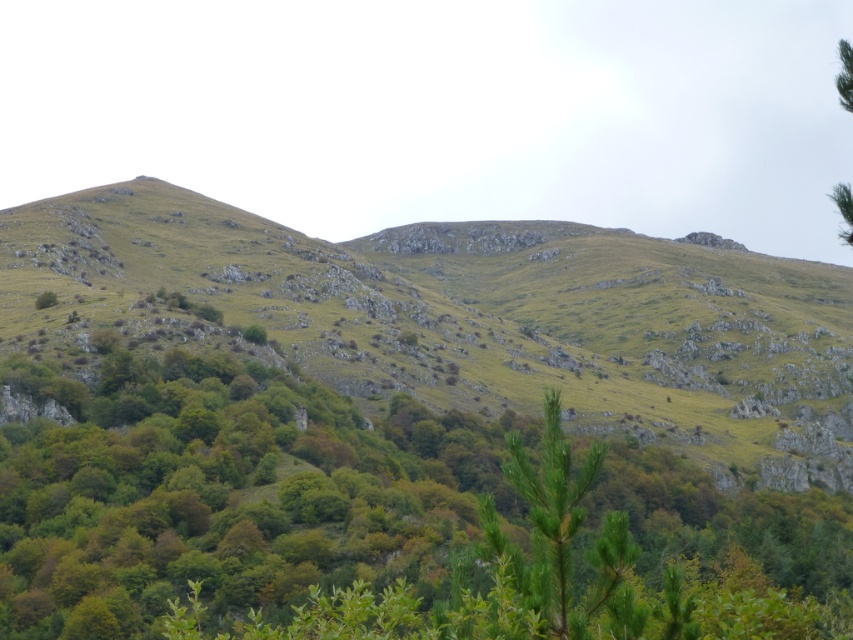
Does green leafy tree at center appear over green needle-like at center?

No, green leafy tree at center is not above green needle-like at center.

Between green leafy tree at center and green needle-like at center, which one has more height?

Standing taller between the two is green leafy tree at center.

Is point (102, 632) more distant than point (486, 624)?

Yes, point (102, 632) is behind point (486, 624).

This screenshot has width=853, height=640. Identify the location of green leafy tree at center. (225, 492).

Can you confirm if green grassy hill at center is thinner than green needle-like at center?

Incorrect, green grassy hill at center's width is not less than green needle-like at center's.

Is green grassy hill at center bigger than green needle-like at center?

Correct, green grassy hill at center is larger in size than green needle-like at center.

Does point (189, 212) come behind point (569, 508)?

Yes, point (189, 212) is behind point (569, 508).

Identify the location of green grassy hill at center. The width and height of the screenshot is (853, 640). (463, 317).

From the picture: Does green needle-like at center appear under green leafy tree at upper right?

Indeed, green needle-like at center is positioned under green leafy tree at upper right.

Is green needle-like at center bigger than green leafy tree at upper right?

Actually, green needle-like at center might be smaller than green leafy tree at upper right.

Does point (515, 582) come behind point (839, 189)?

No, (515, 582) is closer to viewer.

Image resolution: width=853 pixels, height=640 pixels. What are the coordinates of `green needle-like at center` in the screenshot? It's located at (555, 548).